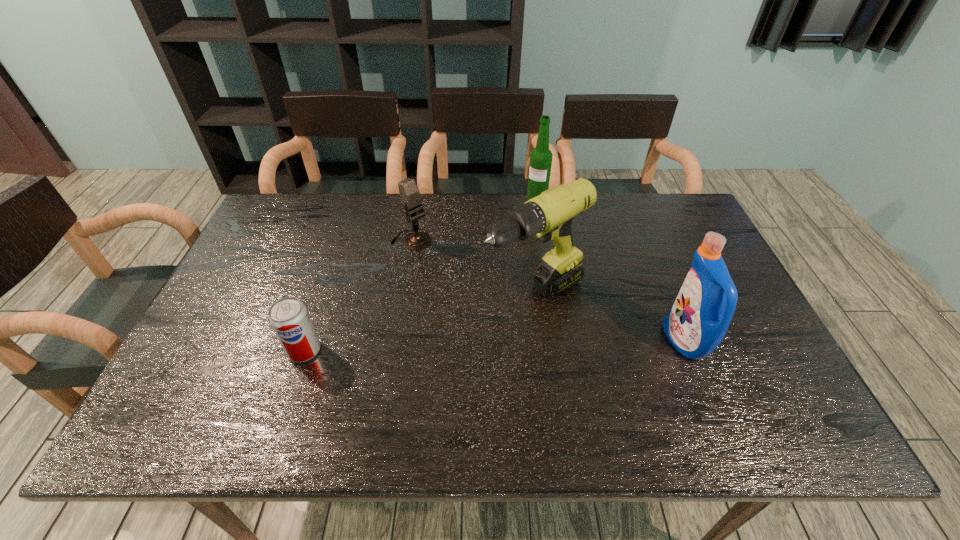
Identify the location of vacant space on the desktop that is between the soda and the detergent and is positioned on the handle side of the drill. (448, 347).

The width and height of the screenshot is (960, 540). I want to click on free spot on the desktop that is between the soda and the rightmost object and is positioned on the front-facing side of the microphone, so click(536, 345).

Image resolution: width=960 pixels, height=540 pixels. I want to click on free space on the desktop that is between the soda and the rightmost object and is positioned on the label of the farthest object, so click(468, 346).